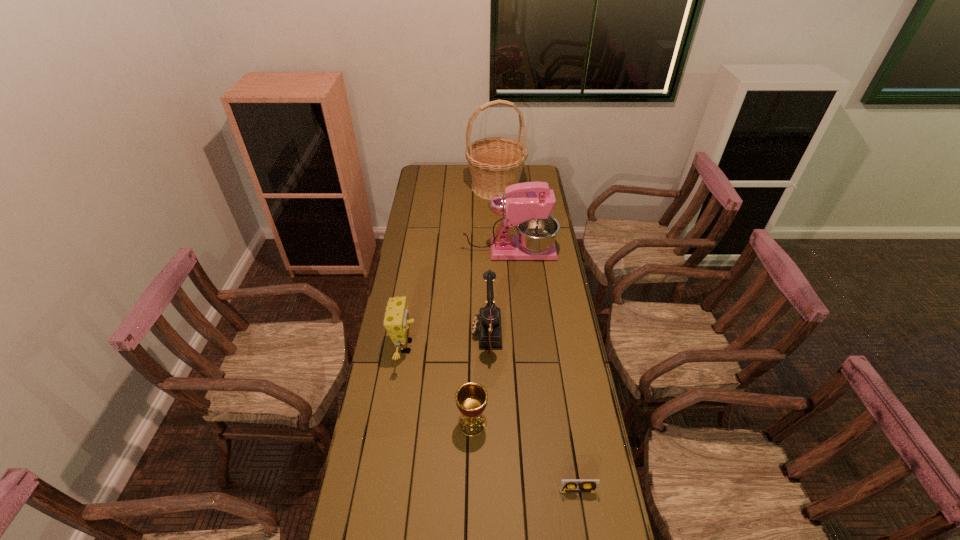
Where is `vacant space in between the telephone and the nearest object`? The image size is (960, 540). vacant space in between the telephone and the nearest object is located at coordinates (532, 414).

I want to click on vacant space that's between the sponge and the tallest object, so click(450, 267).

You are a GUI agent. You are given a task and a screenshot of the screen. Output one action in this format:
    pyautogui.click(x=<x>, y=<y>)
    Task: Click on the vacant area that lies between the second farthest object and the sponge
    The height and width of the screenshot is (540, 960).
    Given the screenshot: What is the action you would take?
    pyautogui.click(x=457, y=299)

Locate an element on the screen. unoccupied position between the tallest object and the fourth shortest object is located at coordinates (492, 261).

The width and height of the screenshot is (960, 540). Identify the location of free space between the fifth tallest object and the nearest object. (525, 457).

I want to click on empty space between the telephone and the fifth shortest object, so click(x=498, y=293).

Locate an element on the screen. object that is the fifth closest to the shortest object is located at coordinates click(495, 163).

Identify which object is the fourth nearest to the sponge. Please provide its 2D coordinates. Your answer should be formatted as a tuple, i.e. [(x, y)], where the tuple contains the x and y coordinates of a point satisfying the conditions above.

[(567, 485)]

The width and height of the screenshot is (960, 540). Identify the location of free region that satisfies the following two spatial constraints: 1. on the front side of the basket; 2. on the face of the fifth shortest object. (498, 251).

The width and height of the screenshot is (960, 540). In order to click on vacant space that satisfies the following two spatial constraints: 1. on the back side of the basket; 2. on the right side of the chalice in this screenshot , I will do (475, 187).